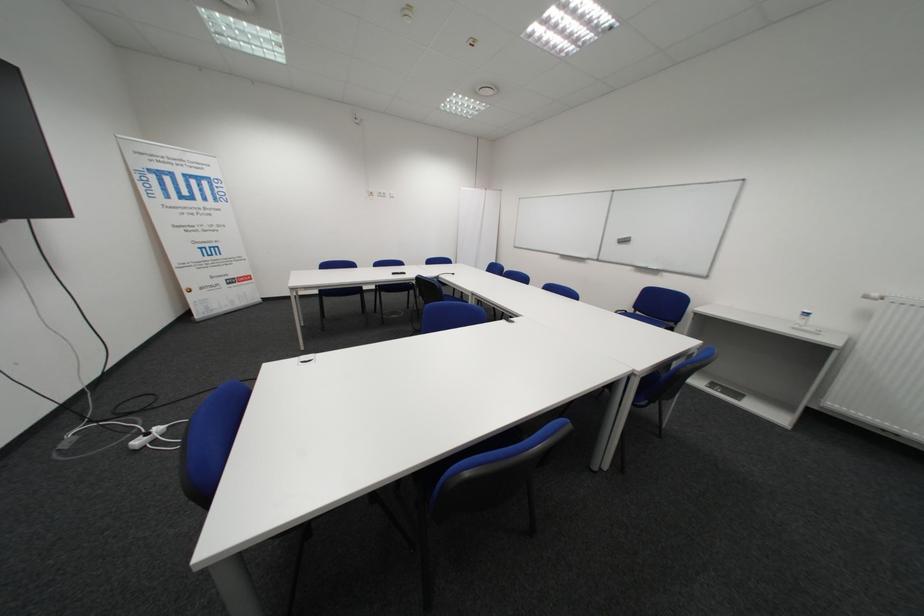
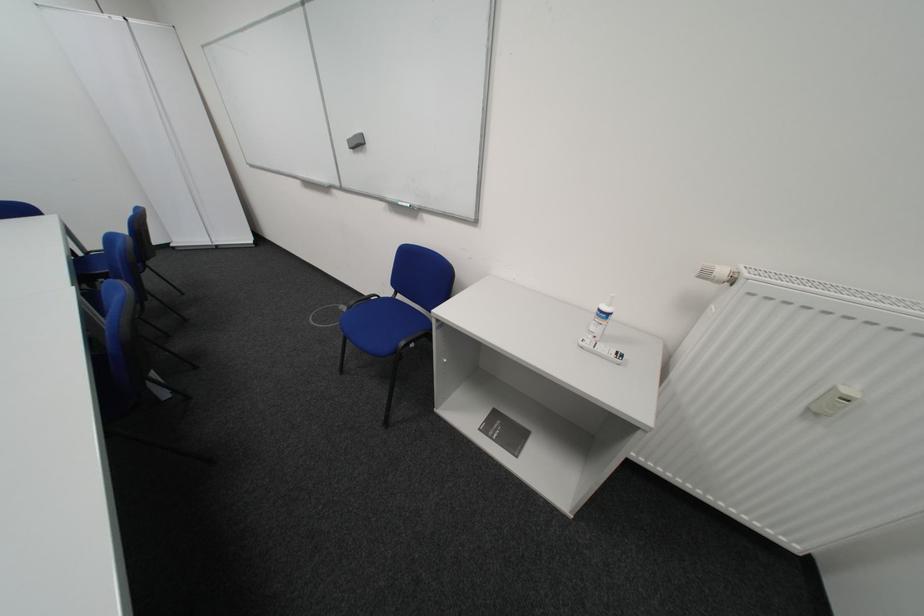
Where in the second image is the point corresponding to (638,313) from the first image?

(390, 297)